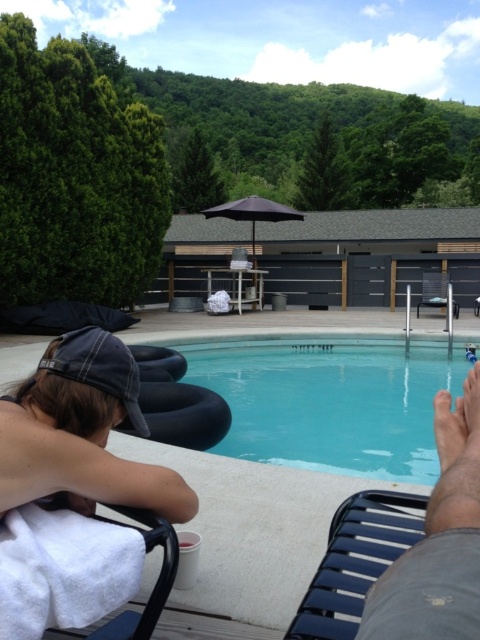
Describe the element at coordinates (357, 561) in the screenshot. I see `black plastic chair at lower right` at that location.

Looking at this image, which of these two, black plastic chair at lower right or metallic silver chair at center, stands shorter?

black plastic chair at lower right

Locate an element on the screen. This screenshot has width=480, height=640. black plastic chair at lower right is located at coordinates (357, 561).

Consider the image. Is smooth tan skin at lower right thinner than metallic silver chair at center?

Indeed, smooth tan skin at lower right has a lesser width compared to metallic silver chair at center.

Is smooth tan skin at lower right to the right of metallic silver chair at center from the viewer's perspective?

No, smooth tan skin at lower right is not to the right of metallic silver chair at center.

Is point (452, 420) closer to camera compared to point (424, 305)?

That is True.

Where is `smooth tan skin at lower right`? This screenshot has height=640, width=480. smooth tan skin at lower right is located at coordinates (439, 540).

Does white towel at lower left have a lesser height compared to black plastic chair at lower right?

No, white towel at lower left is not shorter than black plastic chair at lower right.

Between white towel at lower left and black plastic chair at lower right, which one appears on the right side from the viewer's perspective?

Positioned to the right is black plastic chair at lower right.

Who is more distant from viewer, (118, 420) or (344, 586)?

The point (118, 420) is behind.

At what (x,y) coordinates should I click in order to perform the action: click on white towel at lower left. Please return your answer as a coordinate pair (x, y). This screenshot has height=640, width=480. Looking at the image, I should click on (73, 486).